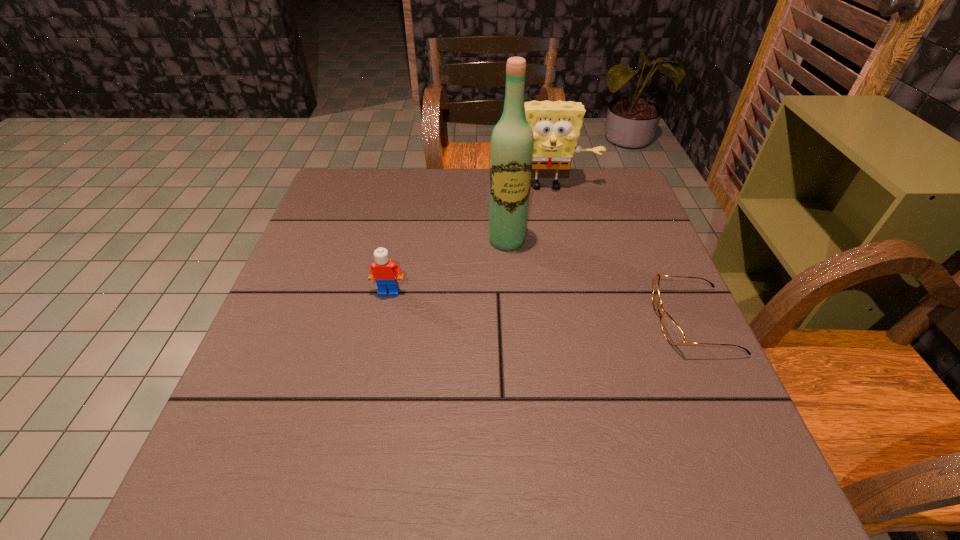
Locate an element on the screen. the second closest object to the leftmost object is located at coordinates (556, 126).

The image size is (960, 540). Identify the location of free space that satisfies the following two spatial constraints: 1. on the front side of the shortest object; 2. on the front-facing side of the sponge. (572, 321).

Identify the location of vacant region that satisfies the following two spatial constraints: 1. on the face of the spectacles; 2. on the front-facing side of the Lego. (383, 321).

Where is `free space that satisfies the following two spatial constraints: 1. on the front side of the shortest object; 2. on the front-facing side of the farthest object`? The height and width of the screenshot is (540, 960). free space that satisfies the following two spatial constraints: 1. on the front side of the shortest object; 2. on the front-facing side of the farthest object is located at coordinates pos(572,321).

Where is `vacant region that satisfies the following two spatial constraints: 1. on the face of the shortest object; 2. on the front-facing side of the Lego`? This screenshot has height=540, width=960. vacant region that satisfies the following two spatial constraints: 1. on the face of the shortest object; 2. on the front-facing side of the Lego is located at coordinates (383, 321).

Identify the location of vacant space that satisfies the following two spatial constraints: 1. on the face of the Lego; 2. on the front-facing side of the spectacles. (383, 321).